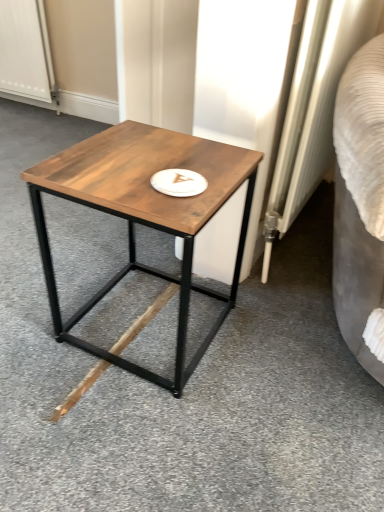
Question: Is wooden table at center at the left side of white textured screen door at upper left?

Choices:
 (A) no
 (B) yes

Answer: (A)

Question: Considering the relative sizes of wooden table at center and white textured screen door at upper left in the image provided, is wooden table at center shorter than white textured screen door at upper left?

Choices:
 (A) no
 (B) yes

Answer: (B)

Question: Is wooden table at center to the right of white textured screen door at upper left from the viewer's perspective?

Choices:
 (A) no
 (B) yes

Answer: (B)

Question: Considering the relative sizes of wooden table at center and white textured screen door at upper left in the image provided, is wooden table at center thinner than white textured screen door at upper left?

Choices:
 (A) no
 (B) yes

Answer: (A)

Question: Is wooden table at center in front of white textured screen door at upper left?

Choices:
 (A) yes
 (B) no

Answer: (A)

Question: Is white textured screen door at upper left wider or thinner than white textured radiator at right?

Choices:
 (A) wide
 (B) thin

Answer: (A)

Question: From the image's perspective, is white textured screen door at upper left located above or below white textured radiator at right?

Choices:
 (A) above
 (B) below

Answer: (A)

Question: Would you say white textured screen door at upper left is to the left or to the right of white textured radiator at right in the picture?

Choices:
 (A) right
 (B) left

Answer: (B)

Question: Relative to white textured radiator at right, is white textured screen door at upper left in front or behind?

Choices:
 (A) behind
 (B) front

Answer: (A)

Question: From a real-world perspective, is wooden table at center positioned above or below white textured radiator at right?

Choices:
 (A) above
 (B) below

Answer: (B)

Question: Based on their sizes in the image, would you say wooden table at center is bigger or smaller than white textured radiator at right?

Choices:
 (A) small
 (B) big

Answer: (B)

Question: Is point (112, 128) positioned closer to the camera than point (289, 110)?

Choices:
 (A) farther
 (B) closer

Answer: (B)

Question: Is wooden table at center taller or shorter than white textured radiator at right?

Choices:
 (A) tall
 (B) short

Answer: (B)

Question: From the image's perspective, is wooden table at center located above or below white textured screen door at upper left?

Choices:
 (A) below
 (B) above

Answer: (A)

Question: Considering the relative positions of wooden table at center and white textured screen door at upper left in the image provided, is wooden table at center to the left or to the right of white textured screen door at upper left?

Choices:
 (A) right
 (B) left

Answer: (A)